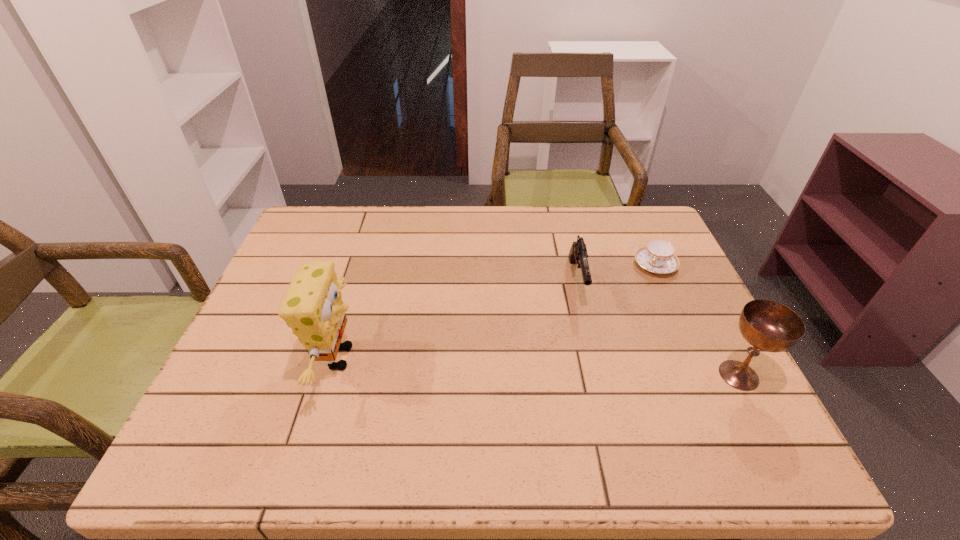
Locate an element on the screen. Image resolution: width=960 pixels, height=540 pixels. the tallest object is located at coordinates (313, 307).

Find the location of a particular element. The width and height of the screenshot is (960, 540). the leftmost object is located at coordinates (313, 307).

What are the coordinates of `the second tallest object` in the screenshot? It's located at (767, 325).

This screenshot has height=540, width=960. Identify the location of the second shortest object. (578, 255).

You are a GUI agent. You are given a task and a screenshot of the screen. Output one action in this format:
    pyautogui.click(x=<x>, y=<y>)
    Task: Click on the gun
    
    Given the screenshot: What is the action you would take?
    pyautogui.click(x=578, y=255)

Image resolution: width=960 pixels, height=540 pixels. What are the coordinates of `teacup` in the screenshot? It's located at (658, 256).

You are a GUI agent. You are given a task and a screenshot of the screen. Output one action in this format:
    pyautogui.click(x=<x>, y=<y>)
    Task: Click on the vacant space situated 0.280m on the face of the leftmost object
    Image resolution: width=960 pixels, height=540 pixels.
    Given the screenshot: What is the action you would take?
    pyautogui.click(x=486, y=357)

At what (x,y) coordinates should I click in order to perform the action: click on free point located on the back of the chalice. Please return your answer as a coordinate pair (x, y). This screenshot has width=960, height=540. Looking at the image, I should click on (711, 323).

Where is `free space located at the end of the barrel of the third object from right to left`? free space located at the end of the barrel of the third object from right to left is located at coordinates (587, 325).

I want to click on vacant region located 0.210m at the end of the barrel of the third object from right to left, so click(x=596, y=380).